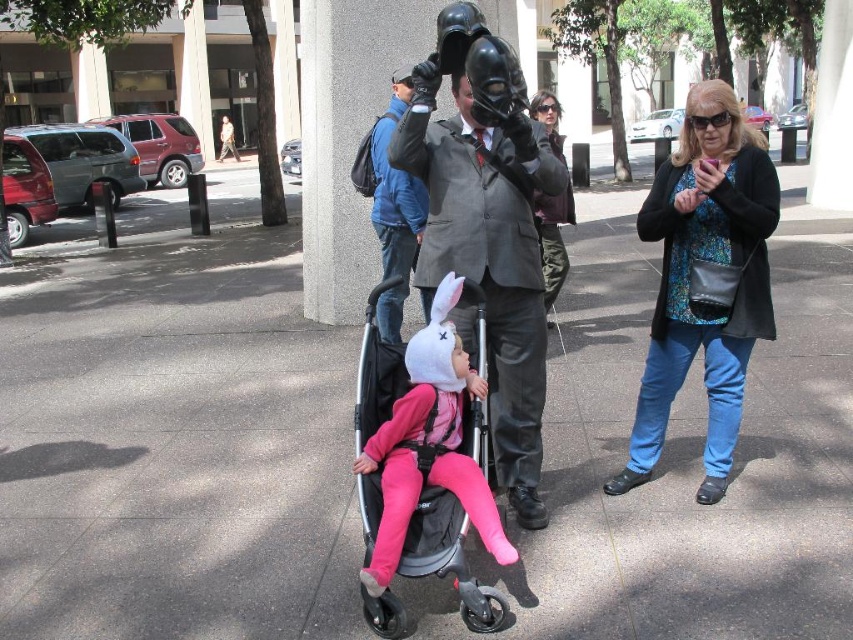
Question: Among these points, which one is farthest from the camera?

Choices:
 (A) (735, 401)
 (B) (434, 428)
 (C) (751, 406)
 (D) (546, 300)

Answer: (D)

Question: Which object is the closest to the blue denim jacket at center?

Choices:
 (A) black matte baby carriage at center
 (B) blue printed top at right
 (C) metallic purple jacket at center
 (D) matte black suit at center

Answer: (C)

Question: Which object is the closest to the metallic purple jacket at center?

Choices:
 (A) blue denim jacket at center
 (B) black matte baby carriage at center
 (C) matte black suit at center
 (D) blue printed top at right

Answer: (C)

Question: Is gray concrete pavement at center smaller than matte black suit at center?

Choices:
 (A) yes
 (B) no

Answer: (B)

Question: Can you confirm if gray concrete pavement at center is positioned below blue printed top at right?

Choices:
 (A) no
 (B) yes

Answer: (A)

Question: Is gray concrete pavement at center to the right of blue denim jacket at center from the viewer's perspective?

Choices:
 (A) no
 (B) yes

Answer: (A)